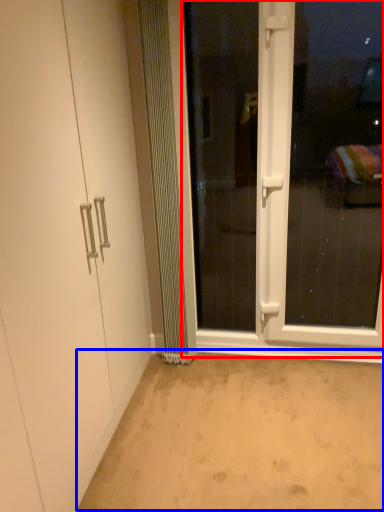
Question: Which object is closer to the camera taking this photo, screen door (highlighted by a red box) or plain (highlighted by a blue box)?

Choices:
 (A) screen door
 (B) plain

Answer: (B)